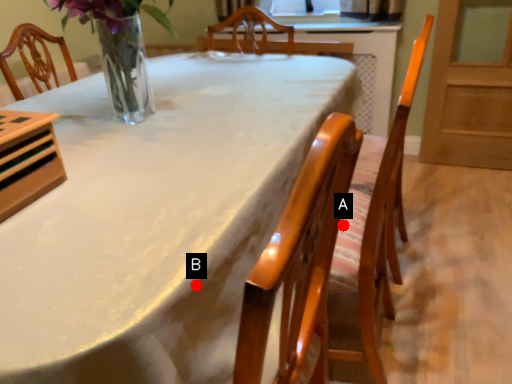
Question: Two points are circled on the image, labeled by A and B beside each circle. Among these points, which one is nearest to the camera?

Choices:
 (A) A is closer
 (B) B is closer

Answer: (B)